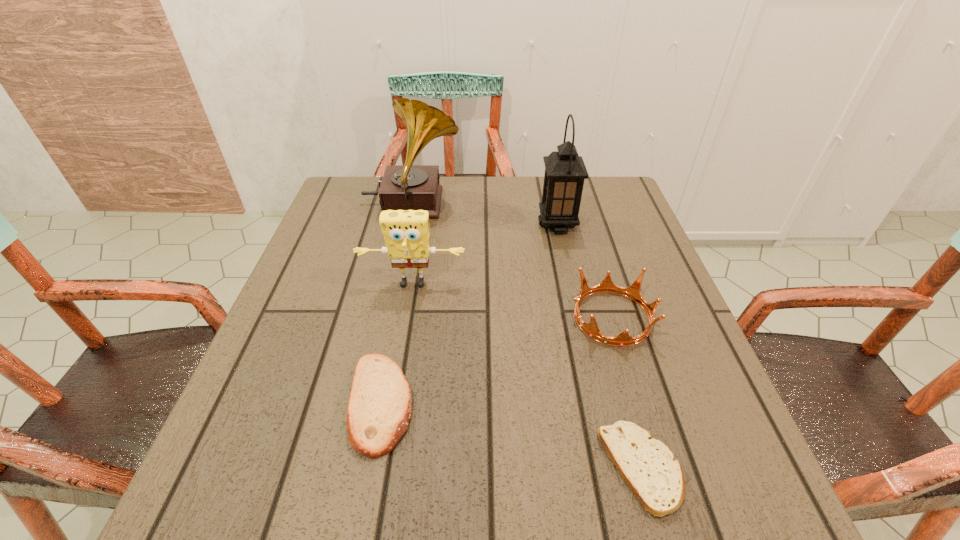
Locate an element on the screen. The height and width of the screenshot is (540, 960). vacant space located 0.360m on the face of the third tallest object is located at coordinates (383, 459).

You are a GUI agent. You are given a task and a screenshot of the screen. Output one action in this format:
    pyautogui.click(x=<x>, y=<y>)
    Task: Click on the vacant position located 0.160m on the back of the crown
    The width and height of the screenshot is (960, 540).
    Given the screenshot: What is the action you would take?
    pyautogui.click(x=590, y=244)

At what (x,y) coordinates should I click in order to perform the action: click on free spot located on the right of the fifth tallest object. Please return your answer as a coordinate pair (x, y). The width and height of the screenshot is (960, 540). Looking at the image, I should click on (519, 403).

At what (x,y) coordinates should I click in order to perform the action: click on vacant area situated 0.050m on the back of the shortest object. Please return your answer as a coordinate pair (x, y). Looking at the image, I should click on (622, 399).

Find the location of a particular element. phonograph record at the far edge is located at coordinates (404, 187).

Where is `lantern present at the far edge`? lantern present at the far edge is located at coordinates (565, 171).

Where is `object present at the near edge`? The width and height of the screenshot is (960, 540). object present at the near edge is located at coordinates (648, 466).

Locate an element on the screen. The width and height of the screenshot is (960, 540). phonograph record that is positioned at the left edge is located at coordinates (404, 187).

Where is `sponge located in the left edge section of the desktop`? This screenshot has width=960, height=540. sponge located in the left edge section of the desktop is located at coordinates (406, 232).

Locate an element on the screen. Image resolution: width=960 pixels, height=540 pixels. lantern that is positioned at the right edge is located at coordinates (565, 171).